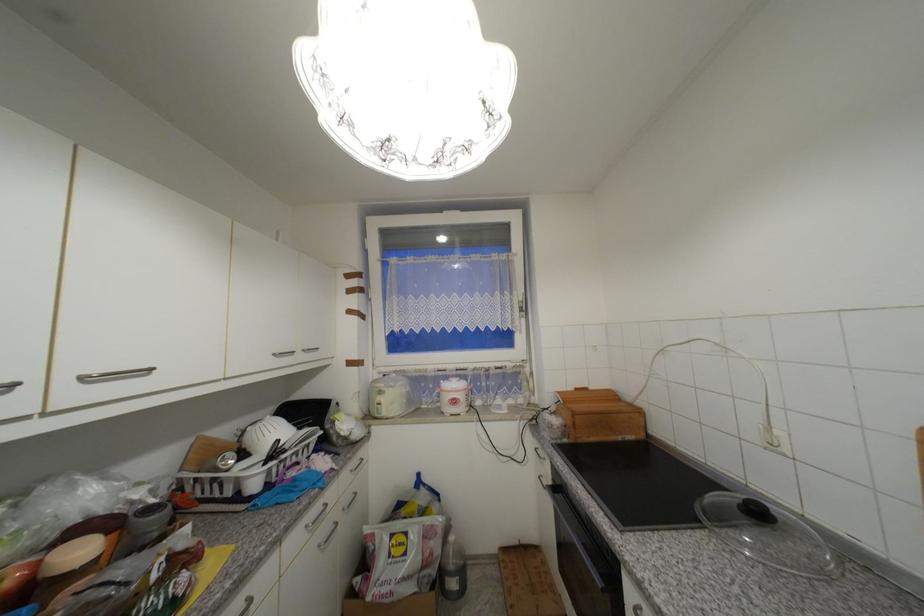
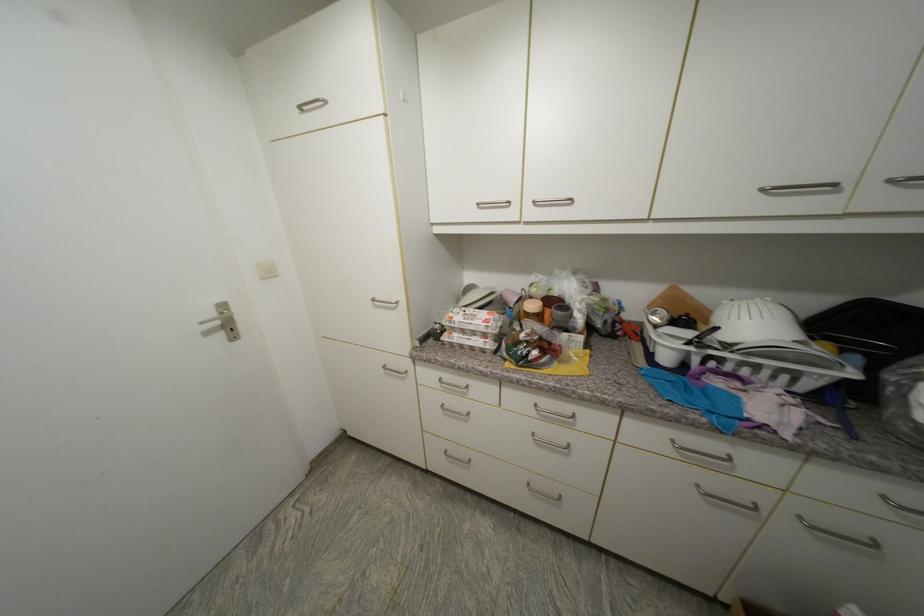
The point at (x=212, y=439) is marked in the first image. Where is the corresponding point in the second image?

(685, 292)